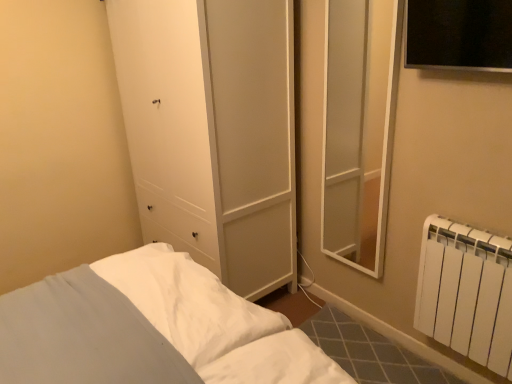
Question: From the image's perspective, is white matte radiator at lower right located beneath white soft pillow at lower left?

Choices:
 (A) no
 (B) yes

Answer: (A)

Question: Is the depth of white matte radiator at lower right less than that of white soft pillow at lower left?

Choices:
 (A) no
 (B) yes

Answer: (A)

Question: Is white matte radiator at lower right to the right of white soft pillow at lower left from the viewer's perspective?

Choices:
 (A) yes
 (B) no

Answer: (A)

Question: Is white matte radiator at lower right behind white soft pillow at lower left?

Choices:
 (A) no
 (B) yes

Answer: (B)

Question: Is white matte radiator at lower right not inside white soft pillow at lower left?

Choices:
 (A) yes
 (B) no

Answer: (A)

Question: From the image's perspective, is white matte radiator at lower right on white soft pillow at lower left?

Choices:
 (A) no
 (B) yes

Answer: (B)

Question: Is white soft pillow at lower left positioned behind white matte radiator at lower right?

Choices:
 (A) yes
 (B) no

Answer: (B)

Question: Is white soft pillow at lower left oriented towards white matte radiator at lower right?

Choices:
 (A) no
 (B) yes

Answer: (B)

Question: From a real-world perspective, does white soft pillow at lower left stand above white matte radiator at lower right?

Choices:
 (A) yes
 (B) no

Answer: (B)

Question: Does white soft pillow at lower left appear on the left side of white matte radiator at lower right?

Choices:
 (A) yes
 (B) no

Answer: (A)

Question: Can you confirm if white soft pillow at lower left is wider than white matte radiator at lower right?

Choices:
 (A) no
 (B) yes

Answer: (B)

Question: From the image's perspective, is white soft pillow at lower left under white matte radiator at lower right?

Choices:
 (A) no
 (B) yes

Answer: (B)

Question: Visually, is white soft pillow at lower left positioned to the left or to the right of white matte radiator at lower right?

Choices:
 (A) right
 (B) left

Answer: (B)